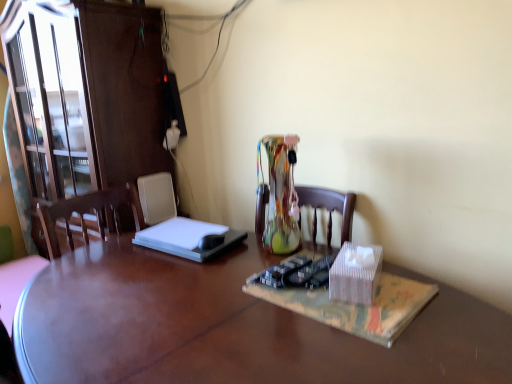
Question: Can you confirm if white cardboard box at center is shorter than matte brown cabinet at left?

Choices:
 (A) yes
 (B) no

Answer: (A)

Question: Is matte brown cabinet at left a part of white cardboard box at center?

Choices:
 (A) no
 (B) yes

Answer: (A)

Question: From the image's perspective, is white cardboard box at center beneath matte brown cabinet at left?

Choices:
 (A) no
 (B) yes

Answer: (B)

Question: Is white cardboard box at center touching matte brown cabinet at left?

Choices:
 (A) no
 (B) yes

Answer: (A)

Question: Is the position of white cardboard box at center more distant than that of matte brown cabinet at left?

Choices:
 (A) yes
 (B) no

Answer: (B)

Question: In the image, is matte brown cabinet at left positioned in front of or behind wooden desk at center?

Choices:
 (A) behind
 (B) front

Answer: (A)

Question: From the image's perspective, is matte brown cabinet at left above or below wooden desk at center?

Choices:
 (A) below
 (B) above

Answer: (B)

Question: Considering the positions of matte brown cabinet at left and wooden desk at center in the image, is matte brown cabinet at left bigger or smaller than wooden desk at center?

Choices:
 (A) small
 (B) big

Answer: (A)

Question: Choose the correct answer: Is matte brown cabinet at left inside wooden desk at center or outside it?

Choices:
 (A) outside
 (B) inside

Answer: (A)

Question: Considering the positions of translucent plastic book at center and white cardboard box at center in the image, is translucent plastic book at center taller or shorter than white cardboard box at center?

Choices:
 (A) tall
 (B) short

Answer: (B)

Question: Considering the positions of translucent plastic book at center and white cardboard box at center in the image, is translucent plastic book at center wider or thinner than white cardboard box at center?

Choices:
 (A) wide
 (B) thin

Answer: (A)

Question: From a real-world perspective, is translucent plastic book at center above or below white cardboard box at center?

Choices:
 (A) below
 (B) above

Answer: (A)

Question: Considering the positions of point (366, 324) and point (373, 254), is point (366, 324) closer or farther from the camera than point (373, 254)?

Choices:
 (A) closer
 (B) farther

Answer: (A)

Question: Is white cardboard box at center wider or thinner than translucent plastic book at center?

Choices:
 (A) thin
 (B) wide

Answer: (A)

Question: Based on their sizes in the image, would you say white cardboard box at center is bigger or smaller than translucent plastic book at center?

Choices:
 (A) small
 (B) big

Answer: (A)